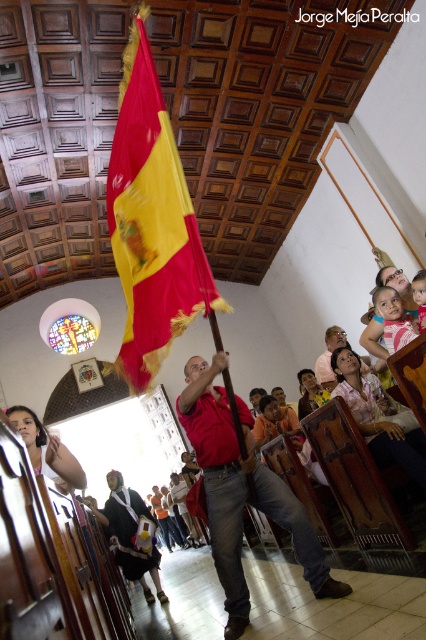
Question: Which of these objects is positioned closest to the red/yellow fabric flag at center?

Choices:
 (A) matte red shirt at center
 (B) white fabric dress at center

Answer: (A)

Question: Does red/yellow fabric flag at center appear on the right side of white fabric dress at center?

Choices:
 (A) no
 (B) yes

Answer: (B)

Question: Based on their relative distances, which object is nearer to the red/yellow fabric flag at center?

Choices:
 (A) matte red shirt at center
 (B) white fabric dress at center

Answer: (A)

Question: Can you confirm if red/yellow fabric flag at center is thinner than matte red shirt at center?

Choices:
 (A) no
 (B) yes

Answer: (B)

Question: Among these objects, which one is farthest from the camera?

Choices:
 (A) red/yellow fabric flag at center
 (B) matte red shirt at center

Answer: (A)

Question: Is matte red shirt at center wider than white fabric dress at center?

Choices:
 (A) yes
 (B) no

Answer: (B)